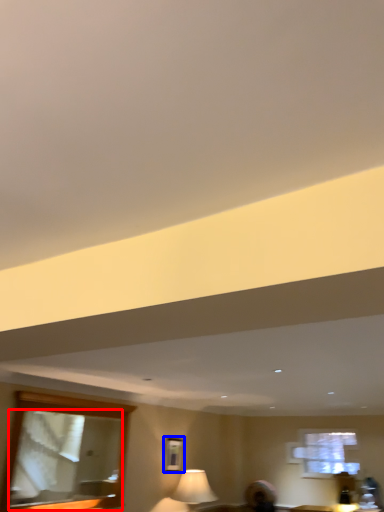
Question: Among these objects, which one is nearest to the camera, mirror (highlighted by a red box) or picture frame (highlighted by a blue box)?

Choices:
 (A) mirror
 (B) picture frame

Answer: (A)